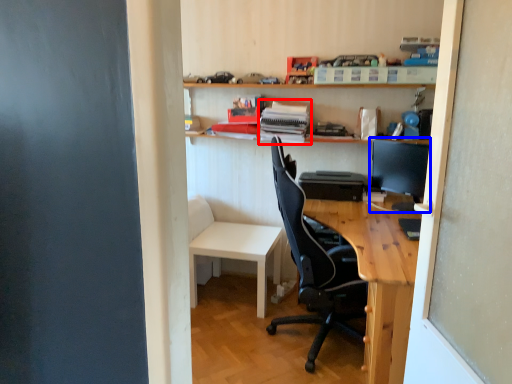
Question: Which object appears farthest to the camera in this image, book (highlighted by a red box) or computer monitor (highlighted by a blue box)?

Choices:
 (A) book
 (B) computer monitor

Answer: (A)